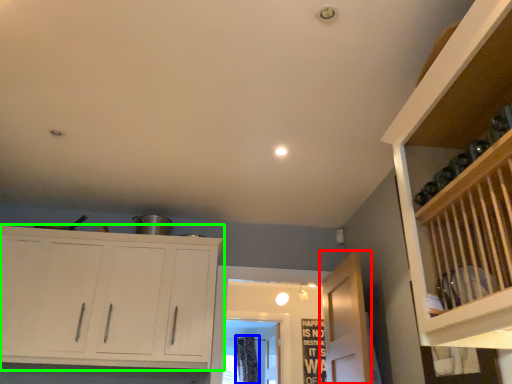
Question: Which object is the farthest from door (highlighted by a red box)? Choose among these: curtain (highlighted by a blue box) or cupboard (highlighted by a green box).

Choices:
 (A) curtain
 (B) cupboard

Answer: (A)